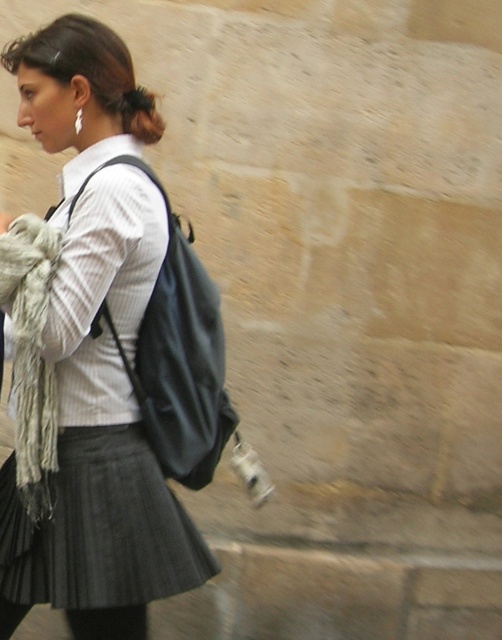
Question: Which of the following is the farthest from the observer?

Choices:
 (A) (148, 112)
 (B) (140, 584)

Answer: (A)

Question: Considering the relative positions of matte black backpack at center and dark brown hair at upper center in the image provided, where is matte black backpack at center located with respect to dark brown hair at upper center?

Choices:
 (A) right
 (B) left

Answer: (B)

Question: Is matte black backpack at center to the right of dark brown hair at upper center from the viewer's perspective?

Choices:
 (A) no
 (B) yes

Answer: (A)

Question: Is matte black backpack at center smaller than dark brown hair at upper center?

Choices:
 (A) yes
 (B) no

Answer: (B)